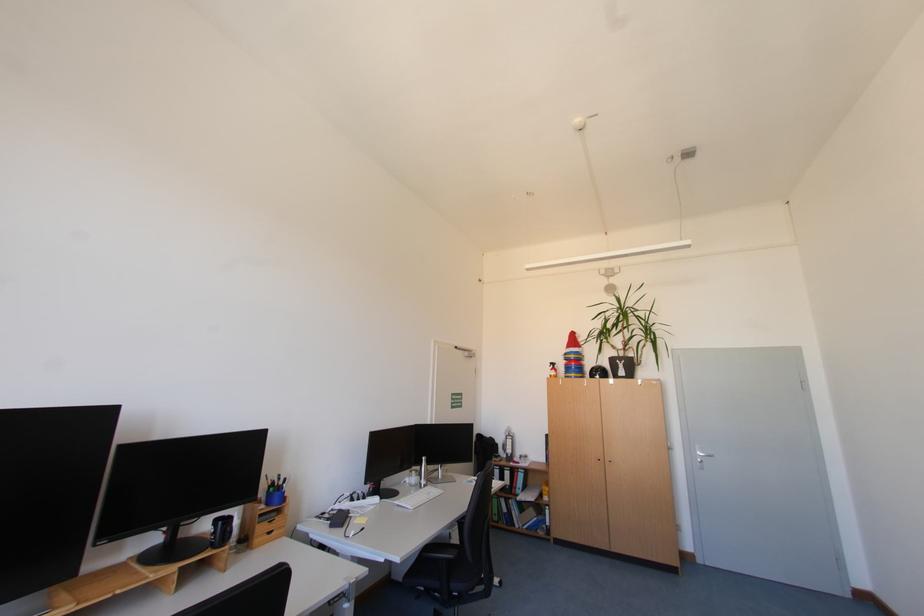
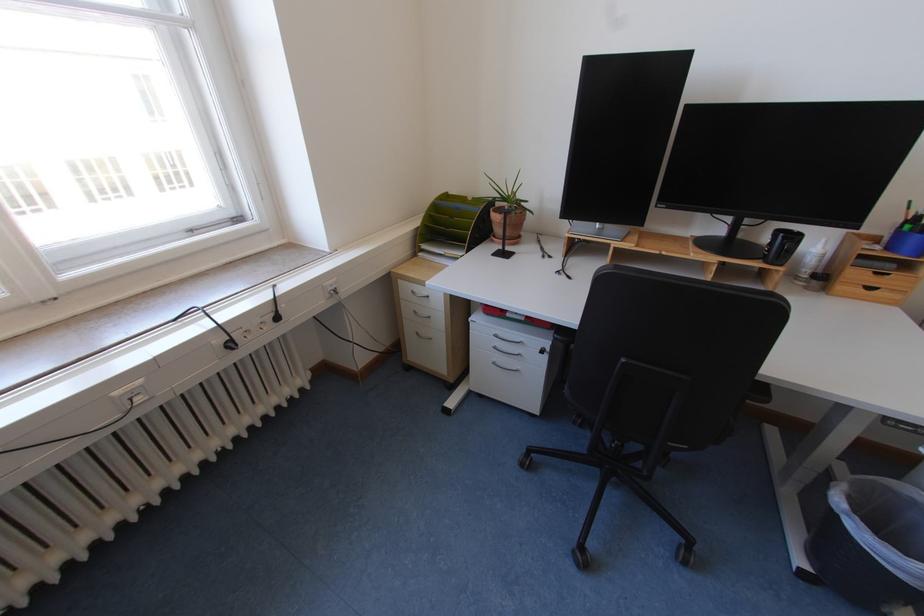
The point at (216, 549) is marked in the first image. Where is the corresponding point in the second image?

(769, 262)